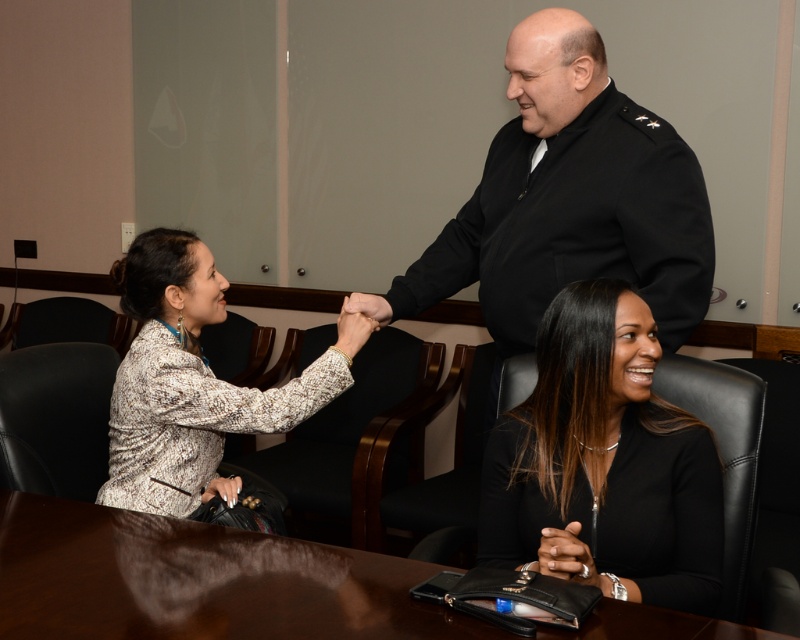
Question: Is brown wooden table at lower center below patterned fabric blouse at left?

Choices:
 (A) yes
 (B) no

Answer: (A)

Question: Which object is the farthest from the brown wooden table at lower center?

Choices:
 (A) black leather chair at lower right
 (B) patterned fabric blouse at left

Answer: (B)

Question: Is black leather chair at lower right to the left of patterned fabric blouse at left from the viewer's perspective?

Choices:
 (A) yes
 (B) no

Answer: (B)

Question: Which is farther from the black leather chair at lower right?

Choices:
 (A) patterned fabric blouse at left
 (B) brown wooden table at lower center

Answer: (A)

Question: Which point is closer to the camera?

Choices:
 (A) (520, 486)
 (B) (436, 570)

Answer: (B)

Question: Is brown wooden table at lower center behind patterned fabric blouse at left?

Choices:
 (A) yes
 (B) no

Answer: (B)